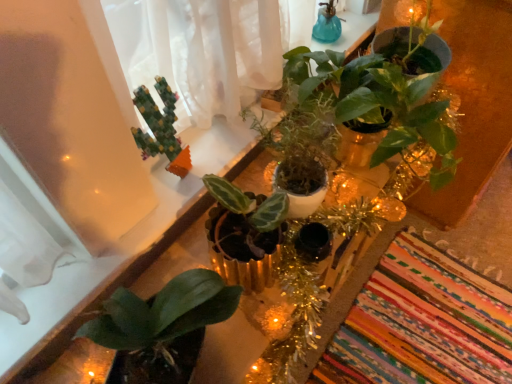
Locate an element on the screen. This screenshot has height=384, width=512. spots to the right of green mosaic cactus at upper left, placed as the first houseplant when sorted from left to right is located at coordinates click(213, 152).